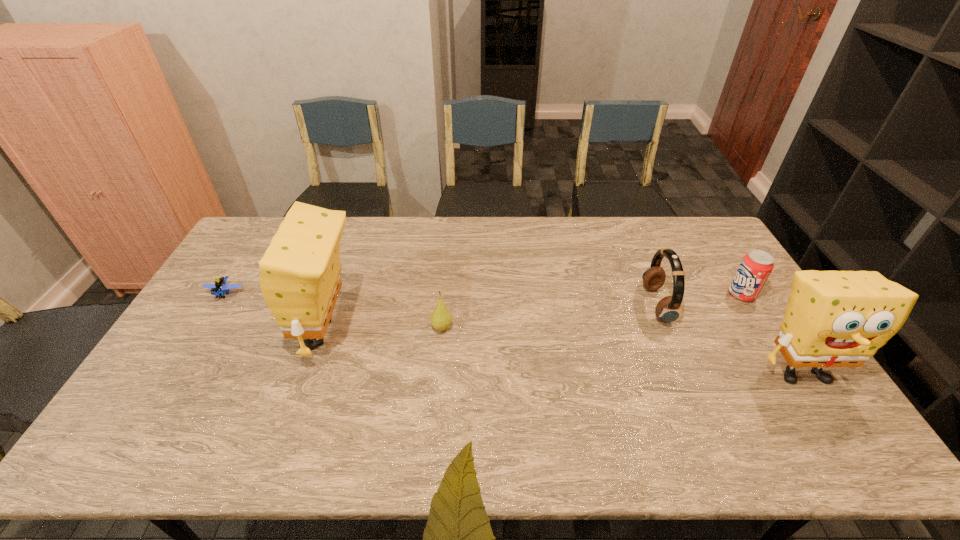
Find the location of a particular element. The image size is (960, 540). the fifth tallest object is located at coordinates (440, 319).

At what (x,y) coordinates should I click in order to perform the action: click on vacant space situated 0.060m on the face of the fifth object from right to left. Please return your answer as a coordinate pair (x, y). Looking at the image, I should click on (267, 333).

Identify the location of vacant space located 0.290m on the face of the fifth object from right to left. (189, 333).

This screenshot has height=540, width=960. I want to click on vacant area situated 0.250m on the face of the fifth object from right to left, so click(203, 333).

I want to click on blank space located on the face of the second tallest object, so click(832, 418).

Find the location of a particular element. vacant space located 0.130m on the ear cup of the headset is located at coordinates (605, 305).

At what (x,y) coordinates should I click in order to perform the action: click on blank space located on the ear cup of the headset. Please return your answer as a coordinate pair (x, y). The width and height of the screenshot is (960, 540). Looking at the image, I should click on (540, 305).

The width and height of the screenshot is (960, 540). In order to click on free spot located on the ear cup of the headset in this screenshot , I will do point(588,305).

The height and width of the screenshot is (540, 960). In order to click on vacant area located on the surface of the fourth tallest object in this screenshot , I will do `click(713, 294)`.

This screenshot has height=540, width=960. What are the coordinates of `vacant space located 0.260m on the surface of the fourth tallest object` in the screenshot? It's located at (647, 294).